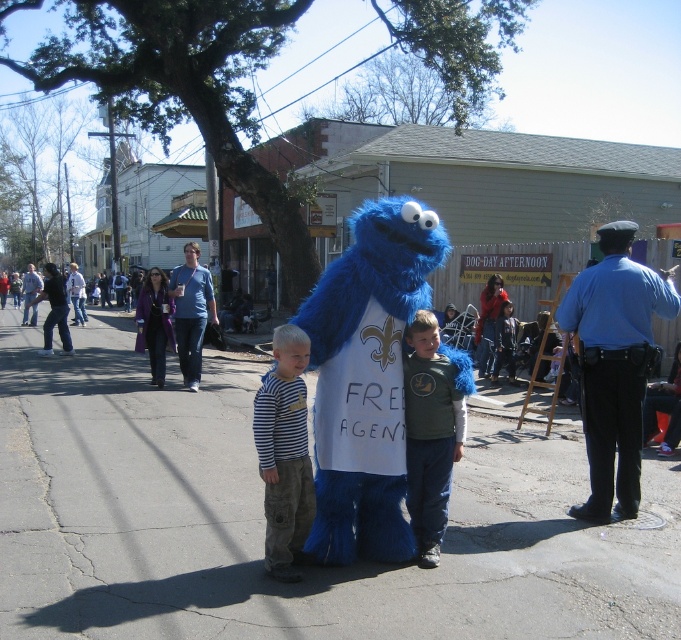
Question: Which object is closer to the camera taking this photo?

Choices:
 (A) fuzzy blue mascot at center
 (B) green cotton shirt at center

Answer: (A)

Question: Can you confirm if striped cotton shirt at center is positioned above blue plush costume at center?

Choices:
 (A) yes
 (B) no

Answer: (B)

Question: Which of these objects is positioned closest to the denim jacket at center?

Choices:
 (A) striped cotton shirt at center
 (B) dark blue jeans at left

Answer: (B)

Question: Does denim jacket at center have a lesser width compared to blue plush costume at center?

Choices:
 (A) no
 (B) yes

Answer: (B)

Question: Does striped cotton shirt at center come in front of denim jacket at center?

Choices:
 (A) yes
 (B) no

Answer: (A)

Question: Estimate the real-world distances between objects in this image. Which object is farther from the blue plush costume at center?

Choices:
 (A) green cotton shirt at center
 (B) blue fuzzy costume at center
 (C) denim jacket at center

Answer: (A)